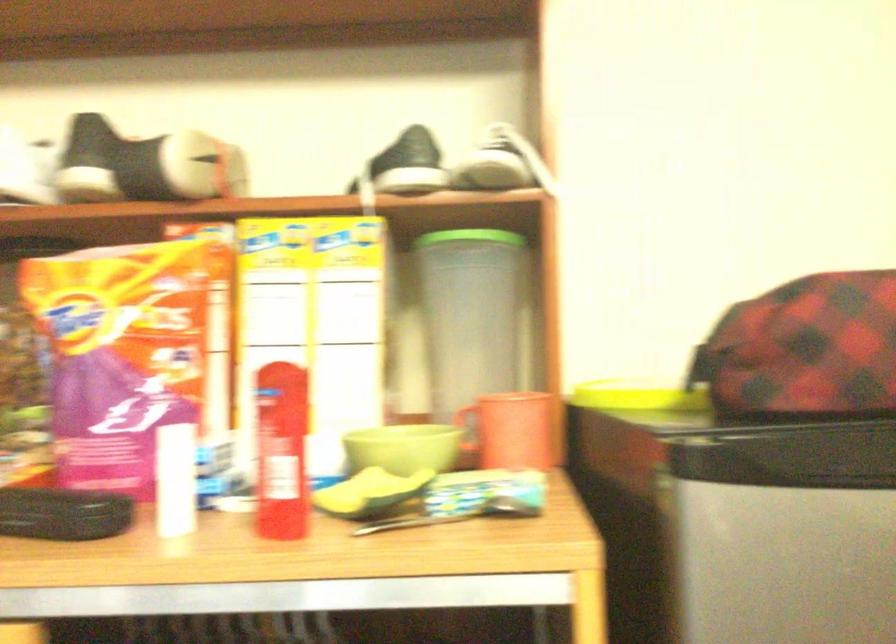
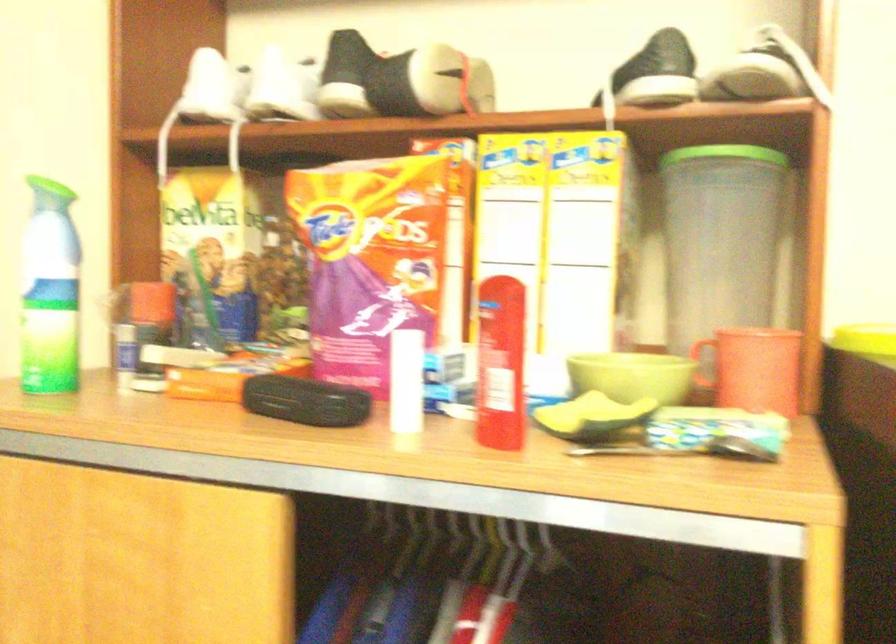
Question: I am providing you with two images of the same scene from different viewpoints. Please identify which objects are invisible in image2.

Choices:
 (A) green spray bottle nozzle
 (B) white shoe
 (C) canister green lid
 (D) none of these

Answer: (D)